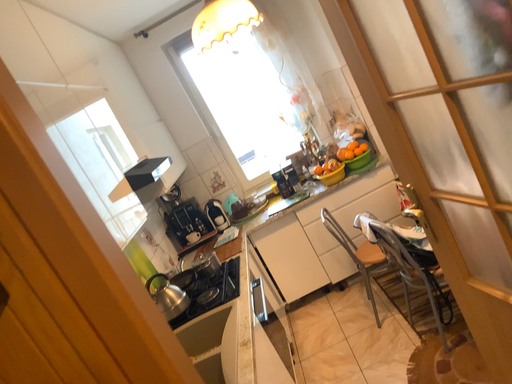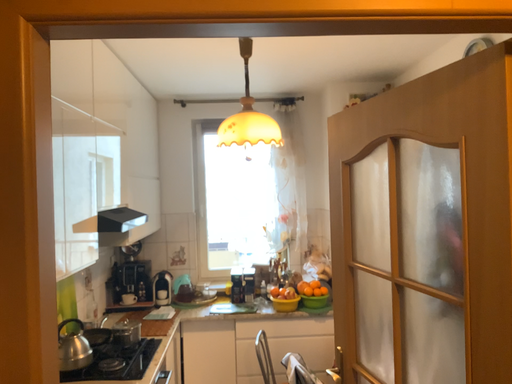
Question: Which way did the camera rotate in the video?

Choices:
 (A) rotated downward
 (B) rotated upward

Answer: (B)